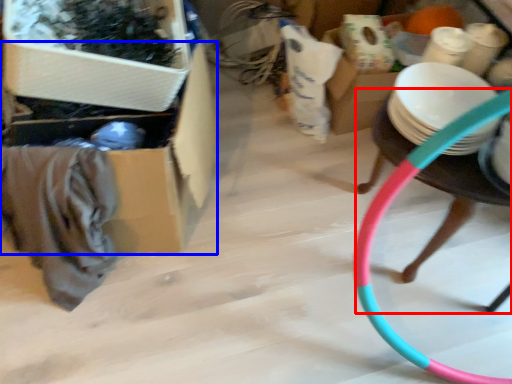
Question: Among these objects, which one is nearest to the camera, chair (highlighted by a red box) or storage box (highlighted by a blue box)?

Choices:
 (A) chair
 (B) storage box

Answer: (A)